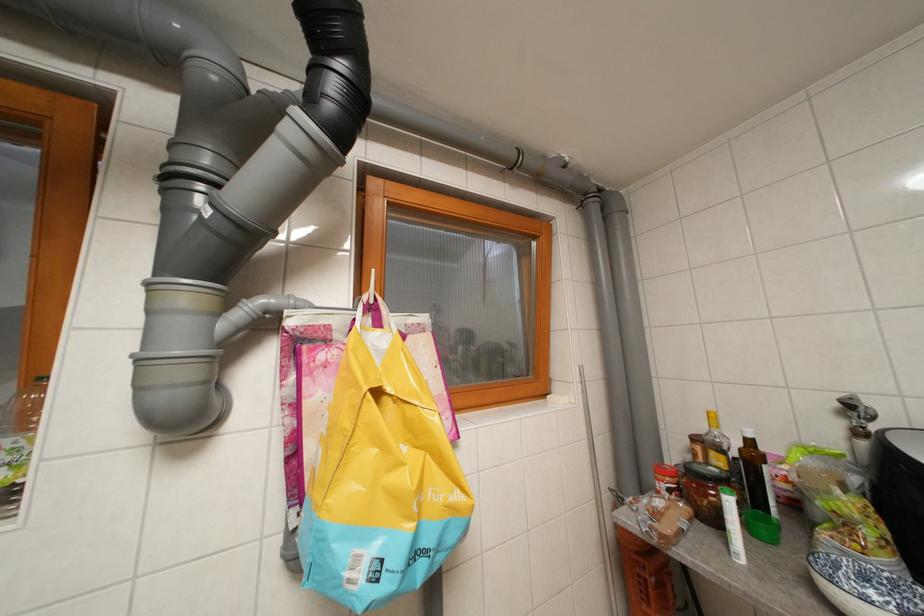
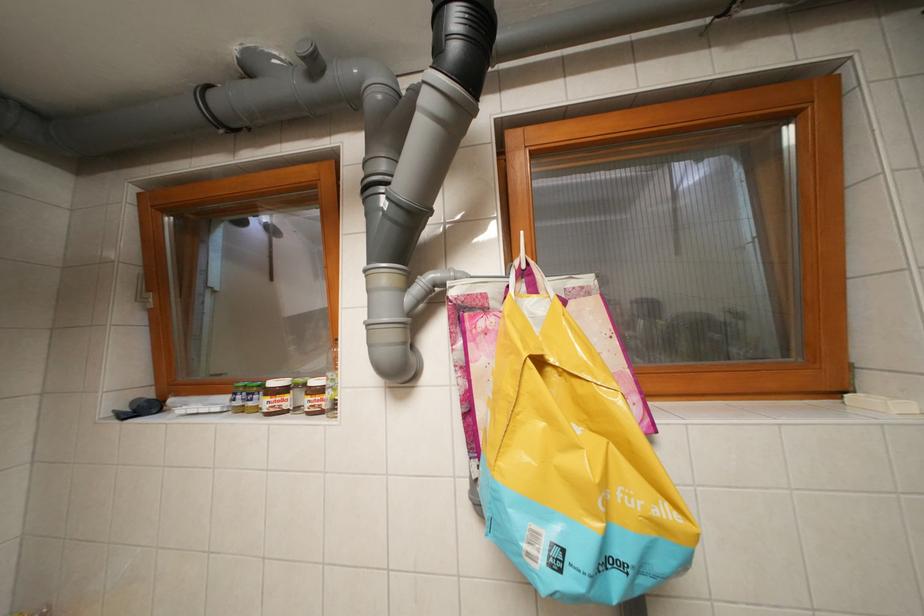
Question: The camera is either moving clockwise (left) or counter-clockwise (right) around the object. The first image is from the beginning of the video and the second image is from the end. Is the camera moving left or right when shooting the video?

Choices:
 (A) Left
 (B) Right

Answer: (B)